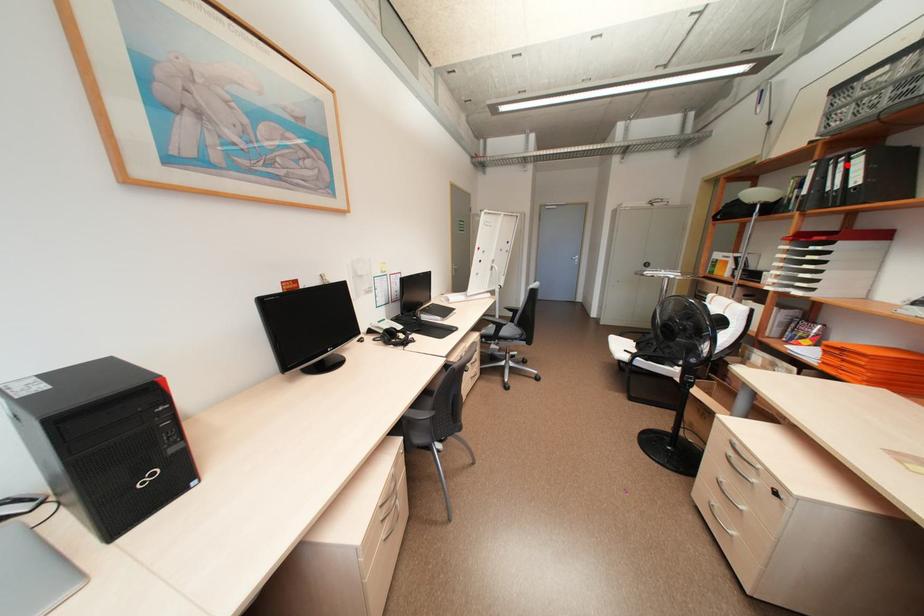
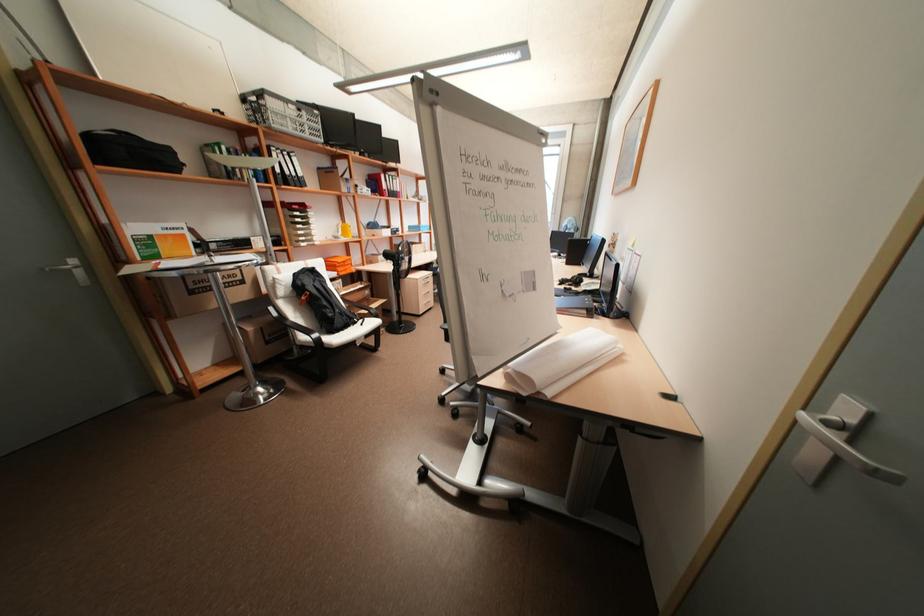
Question: I am providing you with two images of the same scene from different viewpoints. In image1, a red point is highlighted. Considering the same 3D point in image2, which of the following is correct?

Choices:
 (A) It is closer
 (B) It is farther

Answer: (A)